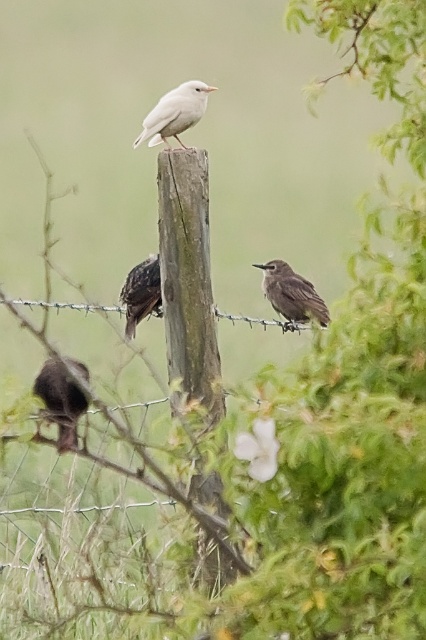
Consider the image. Is white matte bird at center bigger than brown matte bird at center?

Yes, white matte bird at center is bigger than brown matte bird at center.

Is white matte bird at center to the right of brown matte bird at center from the viewer's perspective?

In fact, white matte bird at center is to the left of brown matte bird at center.

What do you see at coordinates (175, 113) in the screenshot? This screenshot has height=640, width=426. I see `white matte bird at center` at bounding box center [175, 113].

Identify the location of white matte bird at center. The image size is (426, 640). (175, 113).

Between weathered wood post at center and wire mesh at center, which one has more height?

weathered wood post at center is taller.

Is weathered wood post at center to the right of wire mesh at center from the viewer's perspective?

Yes, weathered wood post at center is to the right of wire mesh at center.

The height and width of the screenshot is (640, 426). I want to click on weathered wood post at center, so click(187, 278).

Locate an element on the screen. weathered wood post at center is located at coordinates (187, 278).

Is weathered wood post at center shorter than brown speckled bird at center?

Incorrect, weathered wood post at center's height does not fall short of brown speckled bird at center's.

Is weathered wood post at center wider than brown speckled bird at center?

Yes, weathered wood post at center is wider than brown speckled bird at center.

At what (x,y) coordinates should I click in order to perform the action: click on weathered wood post at center. Please return your answer as a coordinate pair (x, y). The height and width of the screenshot is (640, 426). Looking at the image, I should click on (187, 278).